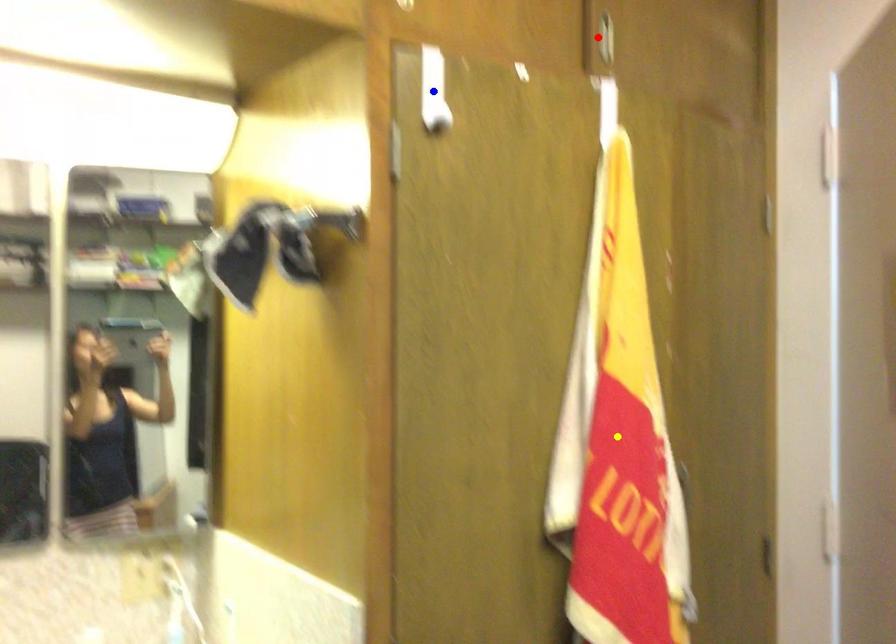
Order these from nearest to farthest:
yellow point, red point, blue point

1. blue point
2. yellow point
3. red point